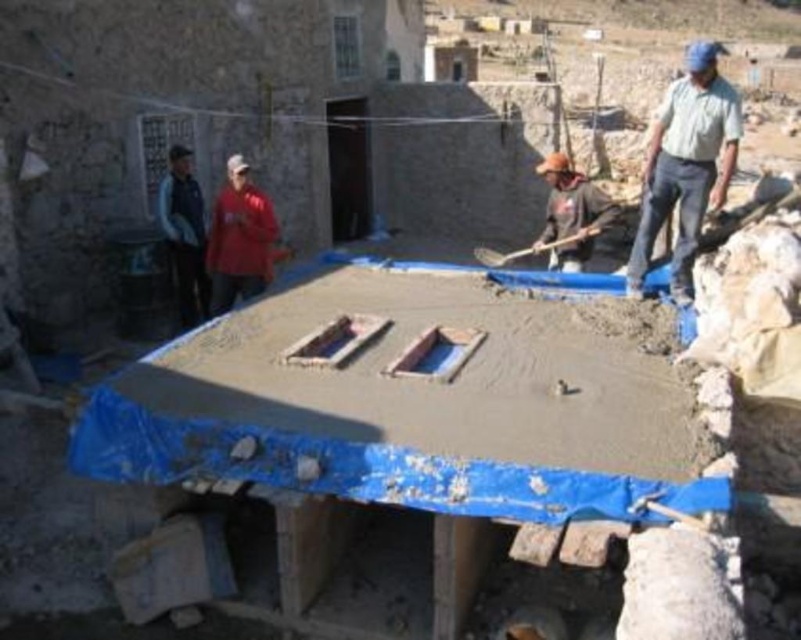
You are a safety inspector at the construction site. You notice two items in the image that could pose tripping hazards. The items are the light blue shirt at upper right and the brown fabric at center. Which item is more likely to be a tripping hazard based on their sizes?

The light blue shirt at upper right is bigger than brown fabric at center, so it is more likely to be a tripping hazard.